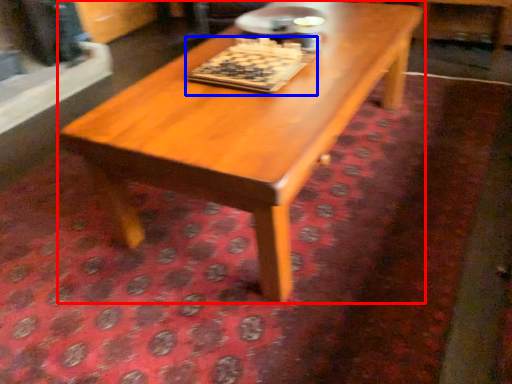
Question: Which of the following is the farthest to the observer, coffee table (highlighted by a red box) or board game (highlighted by a blue box)?

Choices:
 (A) coffee table
 (B) board game

Answer: (B)